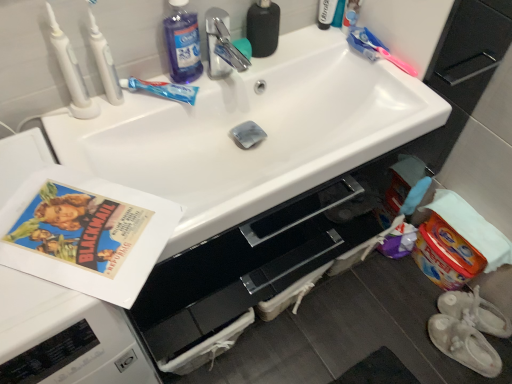
Image resolution: width=512 pixels, height=384 pixels. I want to click on free space on the front side of pink plastic toothbrush at upper right, which is the fourth toothbrush from left to right, so click(x=400, y=97).